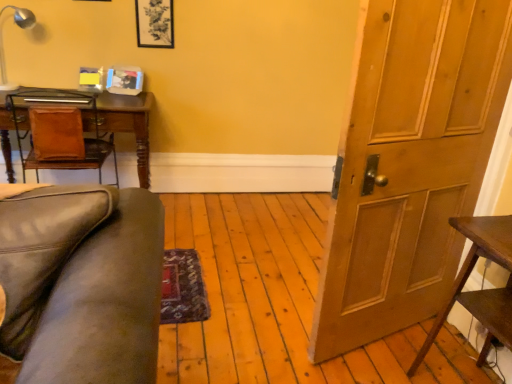
Question: Looking at the image, does brown leather desk at left seem bigger or smaller compared to metallic silver lamp at upper left?

Choices:
 (A) small
 (B) big

Answer: (B)

Question: From the image's perspective, relative to metallic silver lamp at upper left, is brown leather desk at left above or below?

Choices:
 (A) above
 (B) below

Answer: (B)

Question: Estimate the real-world distances between objects in this image. Which object is closer to the dark brown wooden table at right?

Choices:
 (A) matte black picture frame at upper center
 (B) brown leather desk at left
 (C) metallic silver lamp at upper left
 (D) wooden door at right

Answer: (D)

Question: Estimate the real-world distances between objects in this image. Which object is farther from the wooden door at right?

Choices:
 (A) brown leather desk at left
 (B) matte black picture frame at upper center
 (C) metallic silver lamp at upper left
 (D) dark brown wooden table at right

Answer: (C)